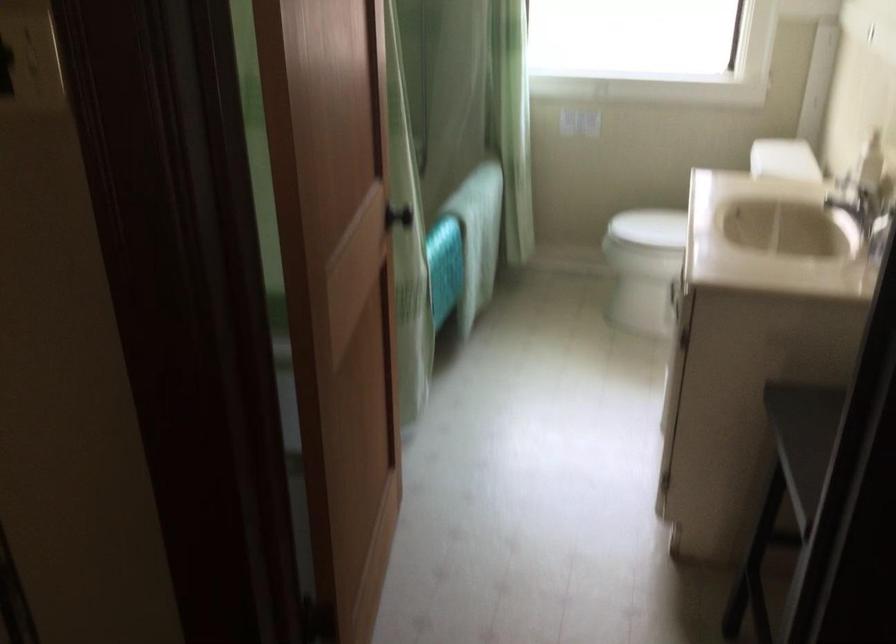
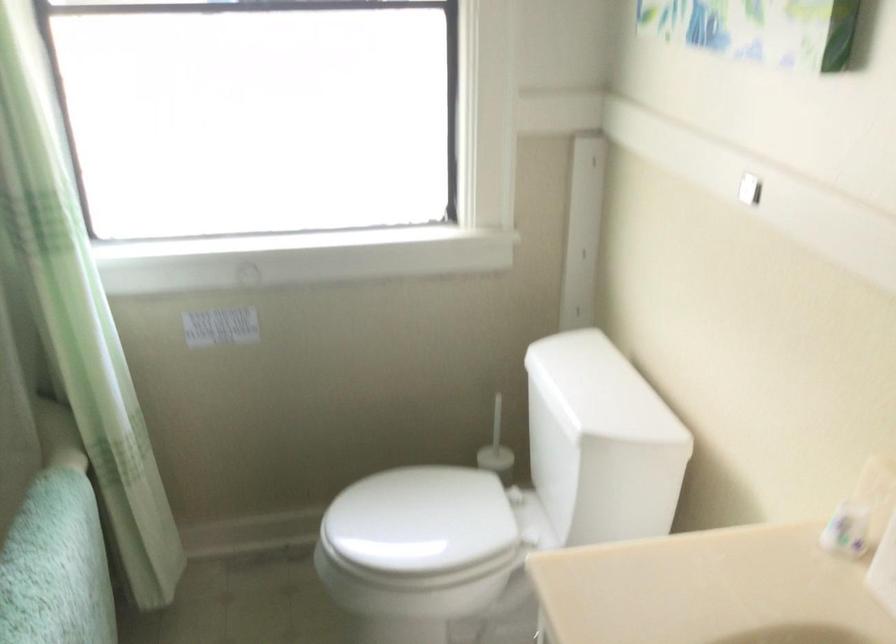
Locate, in the second image, the point that corresponds to pixel 661 227 in the first image.

(419, 526)